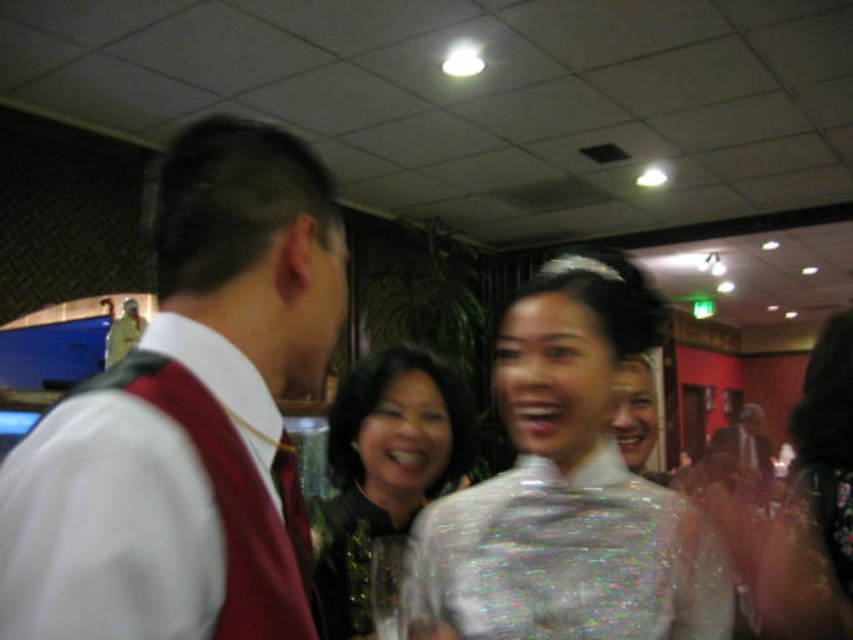
Based on the photo, you are a photographer at this event and want to ensure both the white sheer dress at center and the matte white face at center are clearly visible in your photo. Considering their sizes, which one might require more careful focus adjustment to avoid blurring?

The white sheer dress at center has a larger size compared to the matte white face at center, so it might require more careful focus adjustment to avoid blurring because its larger size could make any slight focus errors more noticeable.

From the picture: You are at a party and want to take a photo of the matte red vest at left and the matte white face at center. Which object should you focus on first if you want to capture both in the same frame without moving the camera?

The matte red vest at left is much taller than the matte white face at center, so you should focus on the taller object first to ensure both are in the frame.

You are a photographer at the event and want to capture a photo of both the white sheer dress at center and the matte white face at center. Which one appears to be more to the left in the frame?

The white sheer dress at center is positioned on the left side of matte white face at center, so it appears more to the left in the frame.